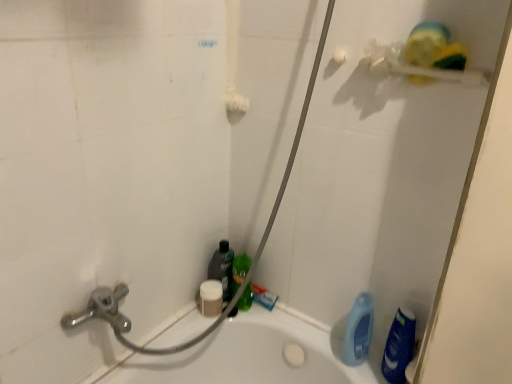
Question: Is there a large distance between yellow sponge at upper right and white matte soap at center?

Choices:
 (A) no
 (B) yes

Answer: (A)

Question: Is yellow sponge at upper right shorter than white matte soap at center?

Choices:
 (A) no
 (B) yes

Answer: (A)

Question: Is yellow sponge at upper right to the left of white matte soap at center from the viewer's perspective?

Choices:
 (A) yes
 (B) no

Answer: (B)

Question: Is yellow sponge at upper right bigger than white matte soap at center?

Choices:
 (A) no
 (B) yes

Answer: (B)

Question: Is yellow sponge at upper right placed right next to white matte soap at center?

Choices:
 (A) yes
 (B) no

Answer: (B)

Question: Could white matte soap at center be considered to be inside yellow sponge at upper right?

Choices:
 (A) yes
 (B) no

Answer: (B)

Question: Can you confirm if white matte soap at center is bigger than green matte bottle at center, which appears as the third cleaning product when viewed from the left?

Choices:
 (A) yes
 (B) no

Answer: (B)

Question: Is white matte soap at center completely or partially outside of green matte bottle at center, the third cleaning product in the right-to-left sequence?

Choices:
 (A) yes
 (B) no

Answer: (A)

Question: Is white matte soap at center not near green matte bottle at center, which appears as the third cleaning product when viewed from the left?

Choices:
 (A) yes
 (B) no

Answer: (B)

Question: Does white matte soap at center turn towards green matte bottle at center, which appears as the third cleaning product when viewed from the left?

Choices:
 (A) yes
 (B) no

Answer: (B)

Question: From the image's perspective, does white matte soap at center appear lower than green matte bottle at center, the third cleaning product in the right-to-left sequence?

Choices:
 (A) yes
 (B) no

Answer: (A)

Question: Is green matte bottle at center, which appears as the third cleaning product when viewed from the left, inside white matte soap at center?

Choices:
 (A) yes
 (B) no

Answer: (B)

Question: Is white matte sponge at lower center, the 5th cleaning product when ordered from right to left, positioned far away from blue glossy bottle at lower right, placed as the 5th cleaning product when sorted from left to right?

Choices:
 (A) no
 (B) yes

Answer: (A)